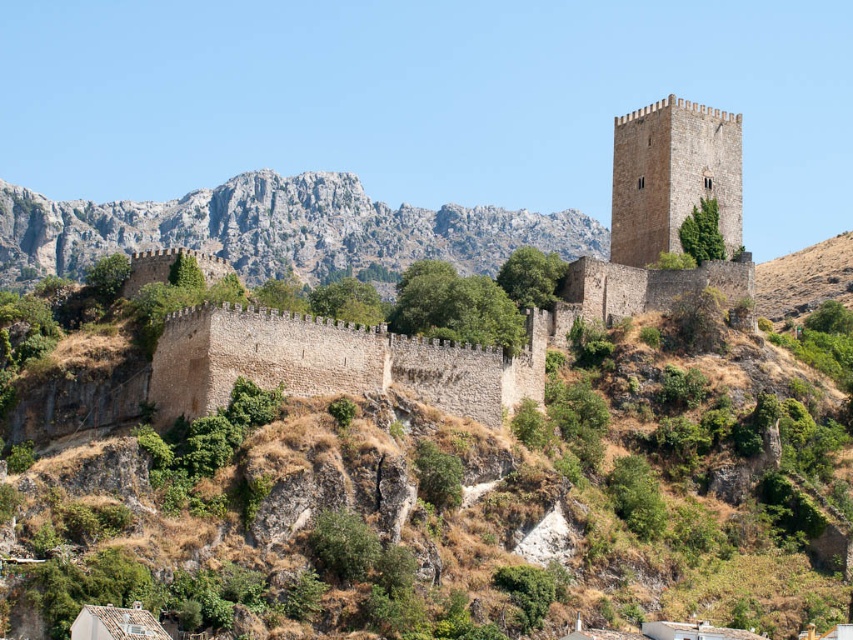
You are a medieval knight approaching the castle from the valley below. You notice the rugged stone mountain at upper center. Based on the coordinates provided, can you determine if the mountain is positioned closer to the top or the bottom of the image?

The rugged stone mountain at upper center is located at coordinates point 0.328 on the vertical axis, which places it closer to the top of the image since the value is less than 0.5.

In the scene shown: You are a medieval engineer tasked with building a bridge between the rugged stone mountain at upper center and the brown stone tower at upper center. Given that your bridge can span up to 130 meters, will it be sufficient to connect the two structures?

The distance between the rugged stone mountain at upper center and the brown stone tower at upper center is 134.52 meters, so the bridge with a 130 meter span would not be sufficient to connect them.

You are a knight approaching the castle from the valley below. You see the rugged stone mountain at upper center and the brown stone tower at upper center. Which one is positioned to the left when viewed from your perspective?

The rugged stone mountain at upper center is to the left of the brown stone tower at upper center from your perspective as you approach the castle from the valley below.